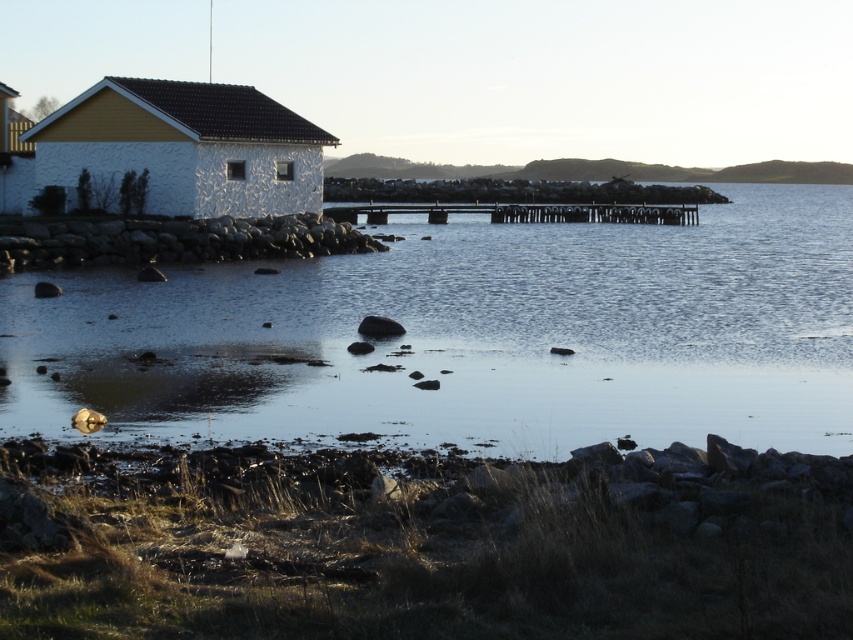
Question: Does gray rock at lower left lie behind brown wooden dock at center?

Choices:
 (A) no
 (B) yes

Answer: (A)

Question: Based on their relative distances, which object is farther from the brown wooden dock at center?

Choices:
 (A) smooth gray rock at center
 (B) gray rock at lower left

Answer: (A)

Question: Is clear water at center to the right of brown wooden dock at center from the viewer's perspective?

Choices:
 (A) no
 (B) yes

Answer: (B)

Question: Which is nearer to the clear water at center?

Choices:
 (A) gray rock at lower left
 (B) smooth gray rock at center
 (C) brown wooden dock at center

Answer: (A)

Question: Which object is positioned closest to the gray rock at lower left?

Choices:
 (A) brown wooden dock at center
 (B) smooth gray rock at center
 (C) clear water at center

Answer: (C)

Question: Is gray rock at lower left thinner than brown wooden dock at center?

Choices:
 (A) yes
 (B) no

Answer: (A)